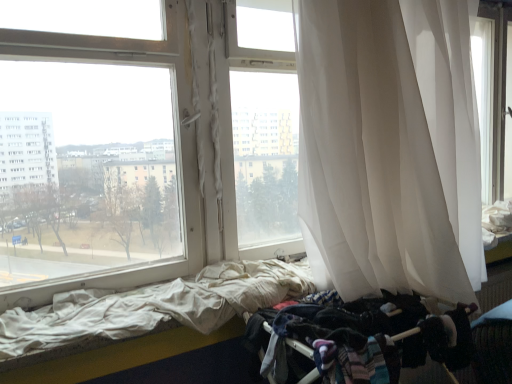
Question: Should I look upward or downward to see white fabric bed at lower left?

Choices:
 (A) down
 (B) up

Answer: (A)

Question: Is the depth of white sheer curtain at right greater than that of dark fabric baby carriage at lower right?

Choices:
 (A) no
 (B) yes

Answer: (A)

Question: From the image's perspective, is white sheer curtain at right under dark fabric baby carriage at lower right?

Choices:
 (A) yes
 (B) no

Answer: (B)

Question: Is white sheer curtain at right positioned beyond the bounds of dark fabric baby carriage at lower right?

Choices:
 (A) yes
 (B) no

Answer: (A)

Question: Is white sheer curtain at right positioned before dark fabric baby carriage at lower right?

Choices:
 (A) yes
 (B) no

Answer: (A)

Question: Is white sheer curtain at right shorter than dark fabric baby carriage at lower right?

Choices:
 (A) yes
 (B) no

Answer: (B)

Question: Does white sheer curtain at right have a lesser width compared to dark fabric baby carriage at lower right?

Choices:
 (A) no
 (B) yes

Answer: (A)

Question: From a real-world perspective, is white fabric bed at lower left physically below white sheer curtain at right?

Choices:
 (A) no
 (B) yes

Answer: (B)

Question: Does white fabric bed at lower left have a lesser width compared to white sheer curtain at right?

Choices:
 (A) yes
 (B) no

Answer: (A)

Question: Is white fabric bed at lower left turned away from white sheer curtain at right?

Choices:
 (A) no
 (B) yes

Answer: (A)

Question: Does white fabric bed at lower left have a greater width compared to white sheer curtain at right?

Choices:
 (A) no
 (B) yes

Answer: (A)

Question: Is white fabric bed at lower left surrounding white sheer curtain at right?

Choices:
 (A) no
 (B) yes

Answer: (A)

Question: From the image's perspective, is white fabric bed at lower left above white sheer curtain at right?

Choices:
 (A) no
 (B) yes

Answer: (A)

Question: Is white sheer curtain at right wider than white fabric bed at lower left?

Choices:
 (A) yes
 (B) no

Answer: (A)